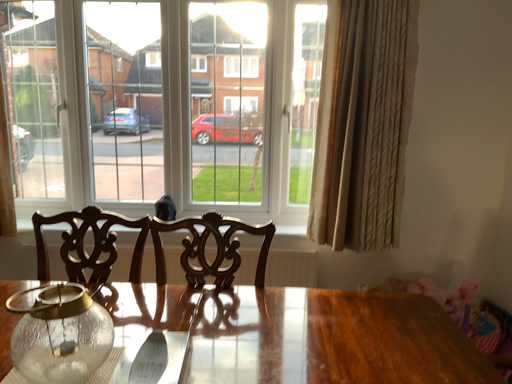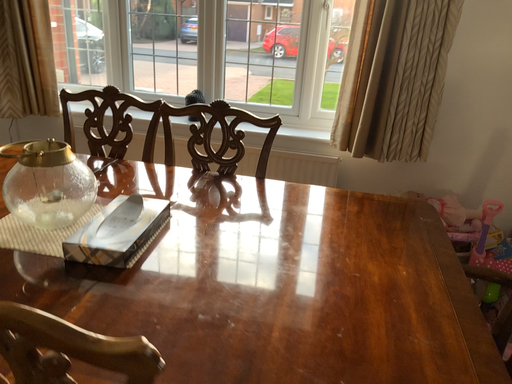
Question: How did the camera likely rotate when shooting the video?

Choices:
 (A) rotated left
 (B) rotated right

Answer: (A)